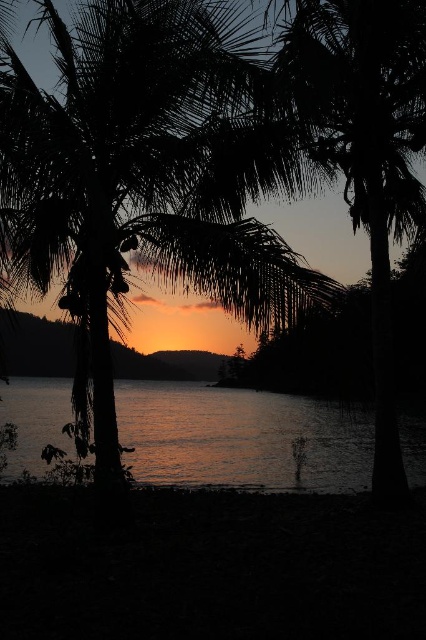
Question: Which object appears farthest from the camera in this image?

Choices:
 (A) silhouette leafy palm at center
 (B) glistening water at center

Answer: (B)

Question: Does silhouette leafy palm at center lie behind glistening water at center?

Choices:
 (A) no
 (B) yes

Answer: (A)

Question: Does silhouette leafy palm at center have a larger size compared to glistening water at center?

Choices:
 (A) yes
 (B) no

Answer: (A)

Question: Which of the following is the farthest from the observer?

Choices:
 (A) (157, 225)
 (B) (368, 438)

Answer: (B)

Question: Is silhouette leafy palm at center behind glistening water at center?

Choices:
 (A) yes
 (B) no

Answer: (B)